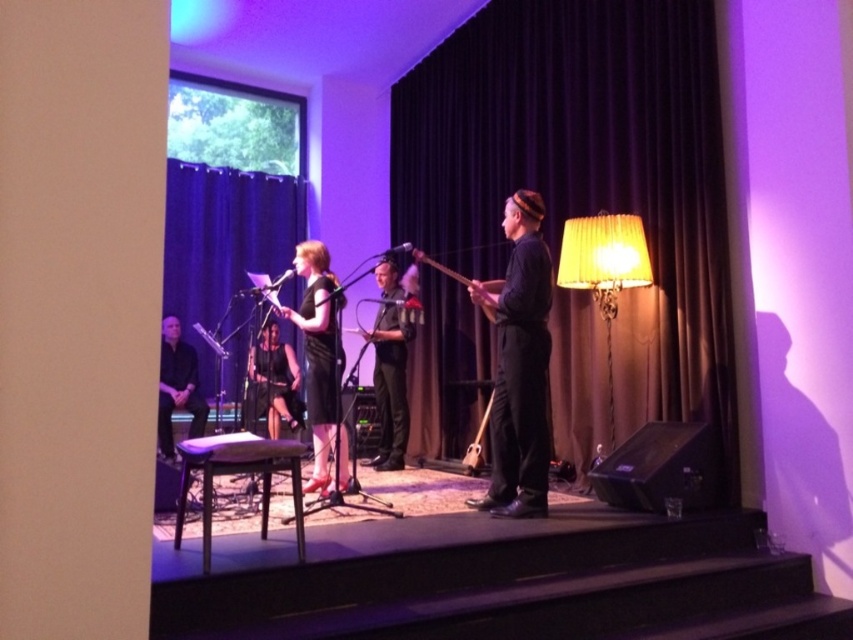
You are a stagehand preparing to adjust the lighting for the performance. You need to ensure that the black fabric curtain at upper left and the black matte dress at center are both visible under the current lighting. Given their sizes, which object might require additional lighting to ensure visibility?

The black fabric curtain at upper left has a larger width than the black matte dress at center, so it might require additional lighting to ensure its visibility since larger objects can sometimes cast more shadows or need more light to be adequately seen.

You are a photographer setting up for a performance. You need to ensure the black matte dress at center is visible in the photo. Is the brown velvet curtain at center blocking it?

The brown velvet curtain at center is positioned over the black matte dress at center, so it is blocking the dress.

You are standing in the performance area and want to move to the point marked at coordinates point (189, 449). The stage is 3 meters wide. Can you walk directly to that point without stepping off the stage?

The distance between you and the point (189, 449) is 2.94 meters, which is within the 3 meter width of the stage. Yes, you can walk directly to the point without stepping off the stage.